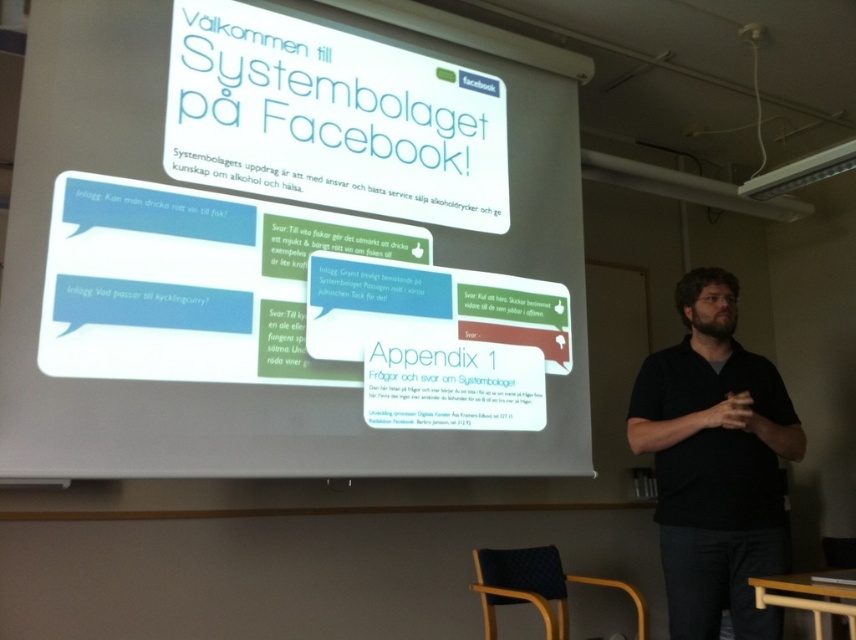
Question: Which object is the farthest from the white paper at upper center?

Choices:
 (A) white paper at center
 (B) black matte shirt at center

Answer: (B)

Question: Can you confirm if white paper at center is positioned above black matte shirt at center?

Choices:
 (A) yes
 (B) no

Answer: (A)

Question: Which is nearer to the black matte shirt at center?

Choices:
 (A) white paper at upper center
 (B) white paper at center

Answer: (A)

Question: Estimate the real-world distances between objects in this image. Which object is closer to the black matte shirt at center?

Choices:
 (A) white paper at upper center
 (B) white paper at center

Answer: (A)

Question: Does white paper at upper center have a greater width compared to black matte shirt at center?

Choices:
 (A) yes
 (B) no

Answer: (A)

Question: Does white paper at upper center have a greater width compared to white paper at center?

Choices:
 (A) yes
 (B) no

Answer: (A)